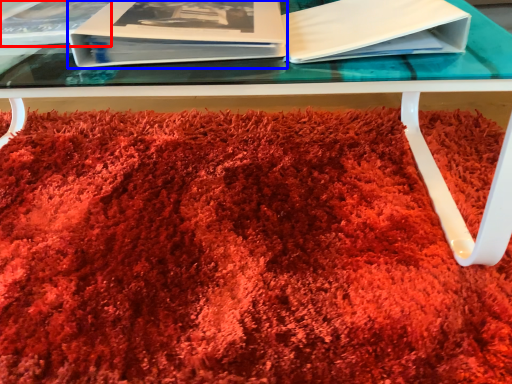
Question: Which object appears farthest to the camera in this image, album (highlighted by a red box) or paperback book (highlighted by a blue box)?

Choices:
 (A) album
 (B) paperback book

Answer: (A)